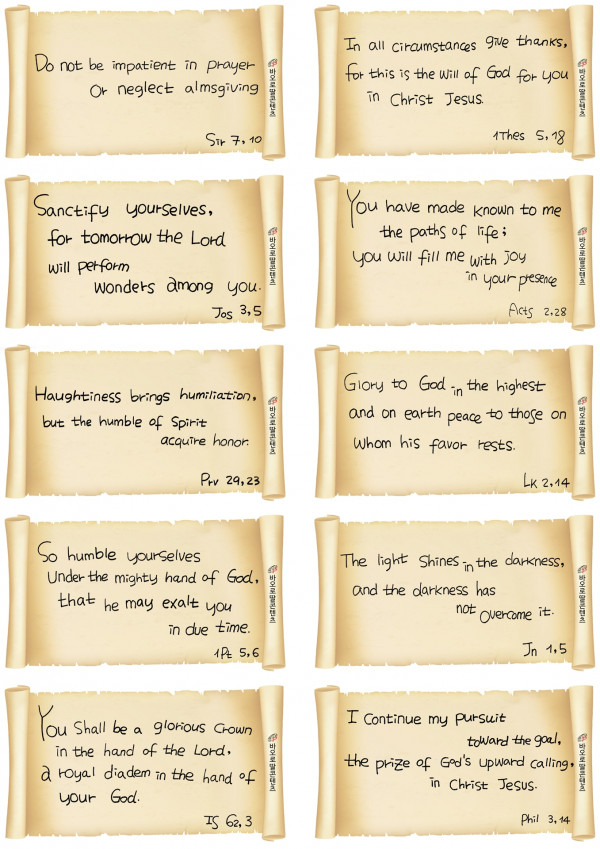
You are a GUI agent. You are given a task and a screenshot of the screen. Output one action in this format:
    pyautogui.click(x=<x>, y=<y>)
    Task: Click on the paper roll
    Image resolution: width=600 pixels, height=849 pixels.
    Given the screenshot: What is the action you would take?
    pyautogui.click(x=20, y=687), pyautogui.click(x=331, y=516), pyautogui.click(x=325, y=343), pyautogui.click(x=15, y=173), pyautogui.click(x=585, y=323), pyautogui.click(x=582, y=486), pyautogui.click(x=329, y=689)